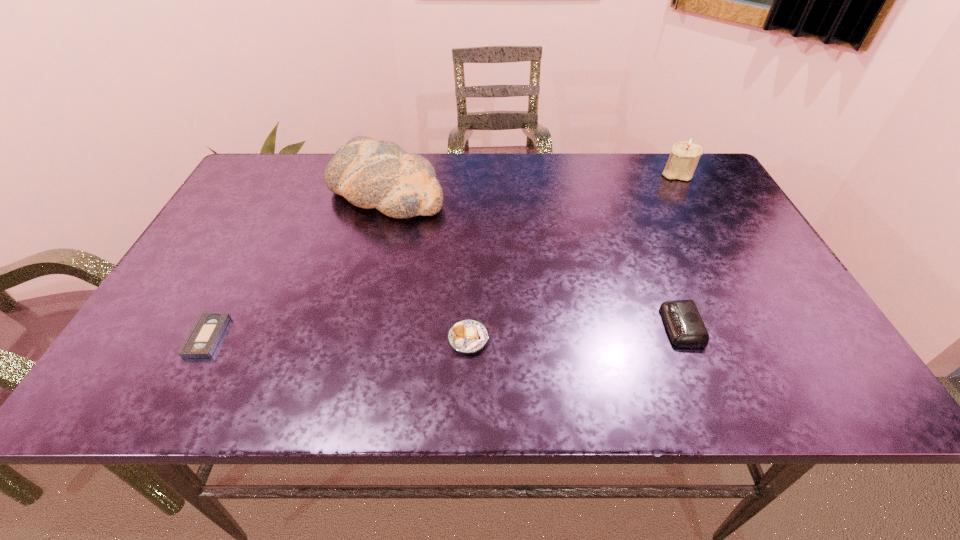
What are the coordinates of `vacant space that's between the videotape and the alarm clock` in the screenshot? It's located at (444, 332).

At what (x,y) coordinates should I click in order to perform the action: click on free space between the pastry and the fourth object from right to left. Please return your answer as a coordinate pair (x, y). This screenshot has width=960, height=540. Looking at the image, I should click on (427, 265).

In order to click on free spot between the second object from right to left and the videotape in this screenshot , I will do `click(444, 332)`.

This screenshot has height=540, width=960. Find the location of `free space between the shortest object and the fourth object from right to left`. free space between the shortest object and the fourth object from right to left is located at coordinates (297, 265).

Find the location of `vacant region between the rightmost object and the shortest object`. vacant region between the rightmost object and the shortest object is located at coordinates (443, 255).

Locate an element on the screen. Image resolution: width=960 pixels, height=540 pixels. free space between the alarm clock and the videotape is located at coordinates (444, 332).

Identify which object is the fourth nearest to the alarm clock. Please provide its 2D coordinates. Your answer should be formatted as a tuple, i.e. [(x, y)], where the tuple contains the x and y coordinates of a point satisfying the conditions above.

[(206, 333)]

The image size is (960, 540). I want to click on object that stands as the second closest to the rightmost object, so click(370, 174).

Locate an element on the screen. The height and width of the screenshot is (540, 960). blank area in the image that satisfies the following two spatial constraints: 1. on the front side of the bread; 2. on the left side of the pastry is located at coordinates (349, 339).

Where is `vacant space that satisfies the following two spatial constraints: 1. on the front side of the shortest object; 2. on the right side of the pastry`? The image size is (960, 540). vacant space that satisfies the following two spatial constraints: 1. on the front side of the shortest object; 2. on the right side of the pastry is located at coordinates (206, 339).